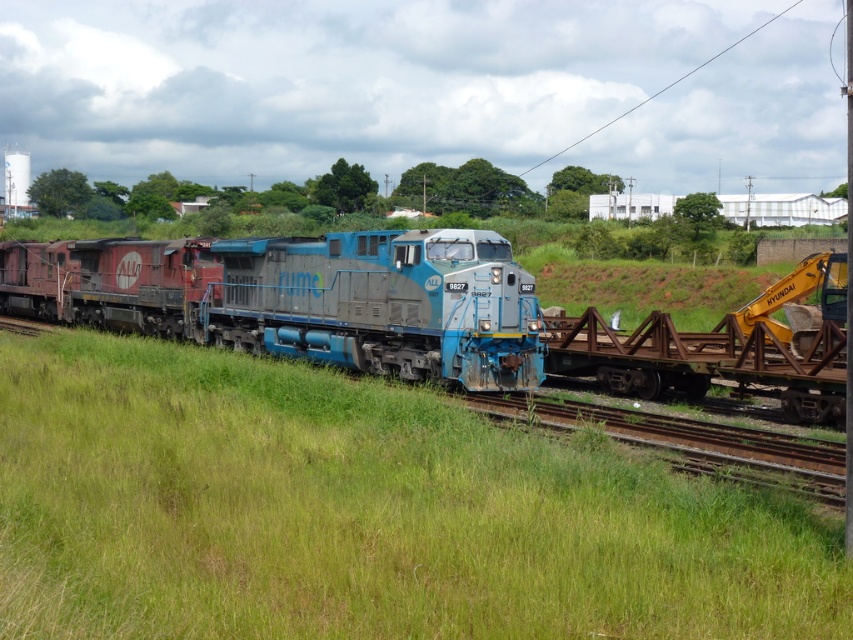
Question: Which of these objects is positioned closest to the blue metallic train at center?

Choices:
 (A) green grassy at center
 (B) rusty metal rail at right

Answer: (B)

Question: Is green grassy at center to the left of blue metallic train at center from the viewer's perspective?

Choices:
 (A) yes
 (B) no

Answer: (B)

Question: Which object is farther from the camera taking this photo?

Choices:
 (A) green grassy at center
 (B) blue metallic train at center

Answer: (B)

Question: Is green grassy at center smaller than rusty metal rail at right?

Choices:
 (A) no
 (B) yes

Answer: (B)

Question: Is blue metallic train at center closer to the viewer compared to rusty metal rail at right?

Choices:
 (A) yes
 (B) no

Answer: (B)

Question: Which is farther from the rusty metal rail at right?

Choices:
 (A) blue metallic train at center
 (B) green grassy at center

Answer: (B)